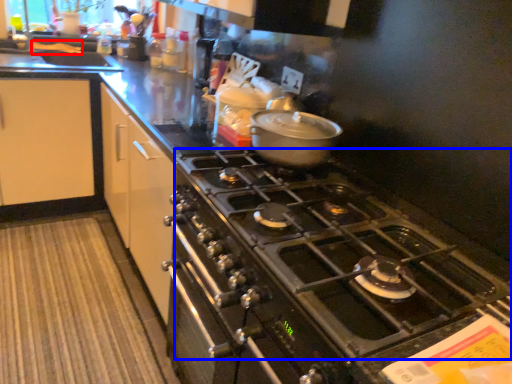
Question: Which object appears closest to the camera in this image, food (highlighted by a red box) or gas stove (highlighted by a blue box)?

Choices:
 (A) food
 (B) gas stove

Answer: (B)